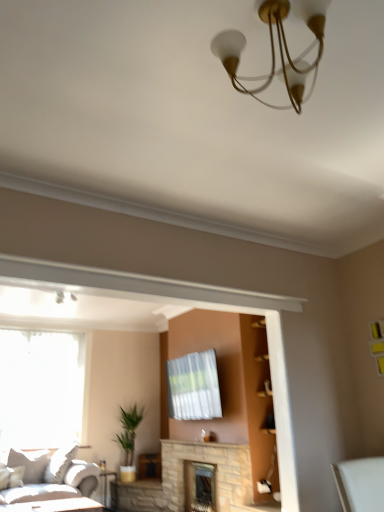
Question: Considering the relative positions of stone fireplace at center, which is the 1th fireplace from front to back, and white glossy table at lower left in the image provided, is stone fireplace at center, which is the 1th fireplace from front to back, to the right of white glossy table at lower left from the viewer's perspective?

Choices:
 (A) yes
 (B) no

Answer: (A)

Question: Would you say stone fireplace at center, which is the 1th fireplace from front to back, is outside white glossy table at lower left?

Choices:
 (A) yes
 (B) no

Answer: (A)

Question: Can you confirm if stone fireplace at center, which is the 1th fireplace from front to back, is bigger than white glossy table at lower left?

Choices:
 (A) no
 (B) yes

Answer: (B)

Question: From a real-world perspective, does stone fireplace at center, which ranks as the second fireplace in back-to-front order, sit lower than white glossy table at lower left?

Choices:
 (A) no
 (B) yes

Answer: (A)

Question: Considering the relative sizes of stone fireplace at center, which is the 1th fireplace from front to back, and white glossy table at lower left in the image provided, is stone fireplace at center, which is the 1th fireplace from front to back, smaller than white glossy table at lower left?

Choices:
 (A) yes
 (B) no

Answer: (B)

Question: Is point (74, 480) positioned closer to the camera than point (29, 504)?

Choices:
 (A) closer
 (B) farther

Answer: (B)

Question: In terms of width, does light gray fabric couch at lower left look wider or thinner when compared to white glossy table at lower left?

Choices:
 (A) thin
 (B) wide

Answer: (B)

Question: In terms of height, does light gray fabric couch at lower left look taller or shorter compared to white glossy table at lower left?

Choices:
 (A) short
 (B) tall

Answer: (B)

Question: In the image, is light gray fabric couch at lower left on the left side or the right side of white glossy table at lower left?

Choices:
 (A) right
 (B) left

Answer: (B)

Question: Is green leafy plant at center in front of or behind white glossy table at lower left in the image?

Choices:
 (A) behind
 (B) front

Answer: (A)

Question: Do you think green leafy plant at center is within white glossy table at lower left, or outside of it?

Choices:
 (A) outside
 (B) inside

Answer: (A)

Question: From the image's perspective, relative to white glossy table at lower left, is green leafy plant at center above or below?

Choices:
 (A) above
 (B) below

Answer: (B)

Question: From a real-world perspective, is green leafy plant at center positioned above or below white glossy table at lower left?

Choices:
 (A) above
 (B) below

Answer: (A)

Question: From a real-world perspective, is matte gold chandelier at upper center physically located above or below white glossy table at lower left?

Choices:
 (A) below
 (B) above

Answer: (B)

Question: From the image's perspective, is matte gold chandelier at upper center located above or below white glossy table at lower left?

Choices:
 (A) below
 (B) above

Answer: (B)